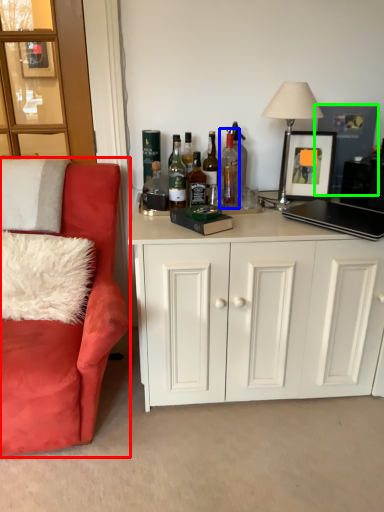
Question: Which object is the closest to the chair (highlighted by a red box)? Choose among these: bottle (highlighted by a blue box) or picture frame (highlighted by a green box).

Choices:
 (A) bottle
 (B) picture frame

Answer: (A)